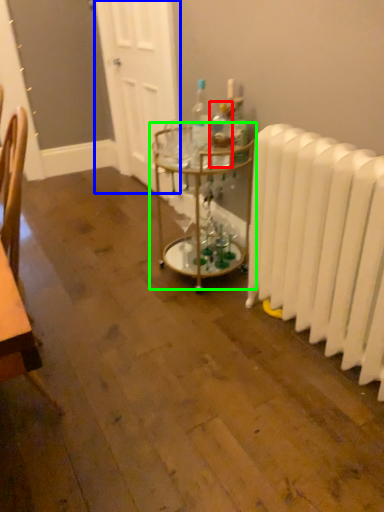
Question: Considering the real-world distances, which object is closest to bottle (highlighted by a red box)? door (highlighted by a blue box) or table (highlighted by a green box).

Choices:
 (A) door
 (B) table

Answer: (B)